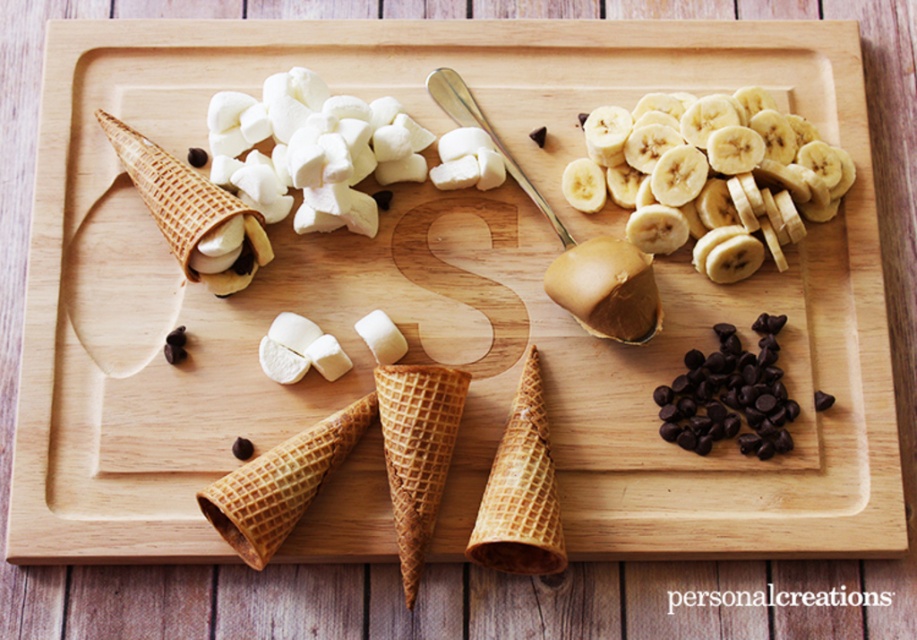
In the scene shown: Is yellow smooth banana at upper right closer to camera compared to dark chocolate chips at lower right?

No, yellow smooth banana at upper right is further to the viewer.

Which of these two, yellow smooth banana at upper right or dark chocolate chips at lower right, stands shorter?

Standing shorter between the two is dark chocolate chips at lower right.

Is point (706, 124) positioned before point (772, 339)?

No, it is not.

This screenshot has width=917, height=640. I want to click on yellow smooth banana at upper right, so click(709, 173).